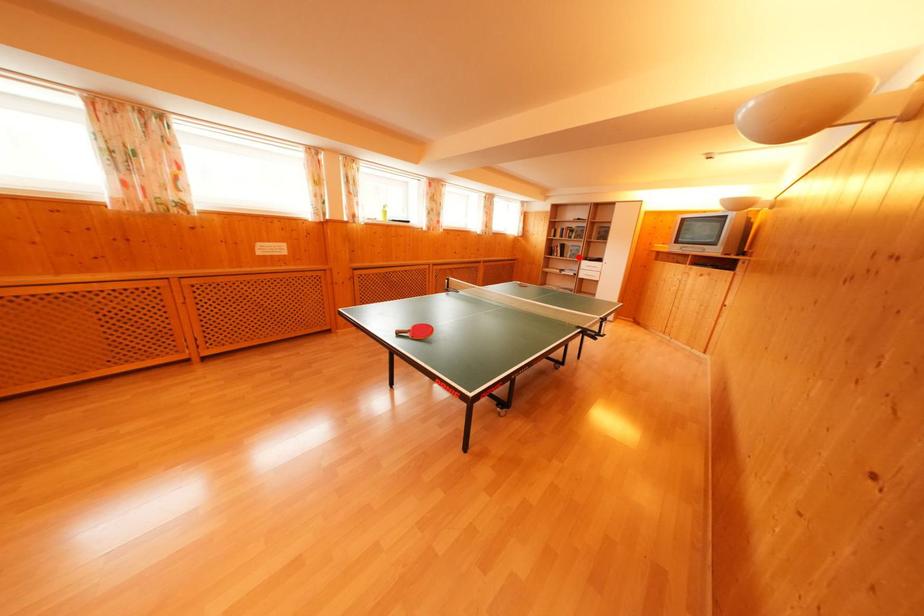
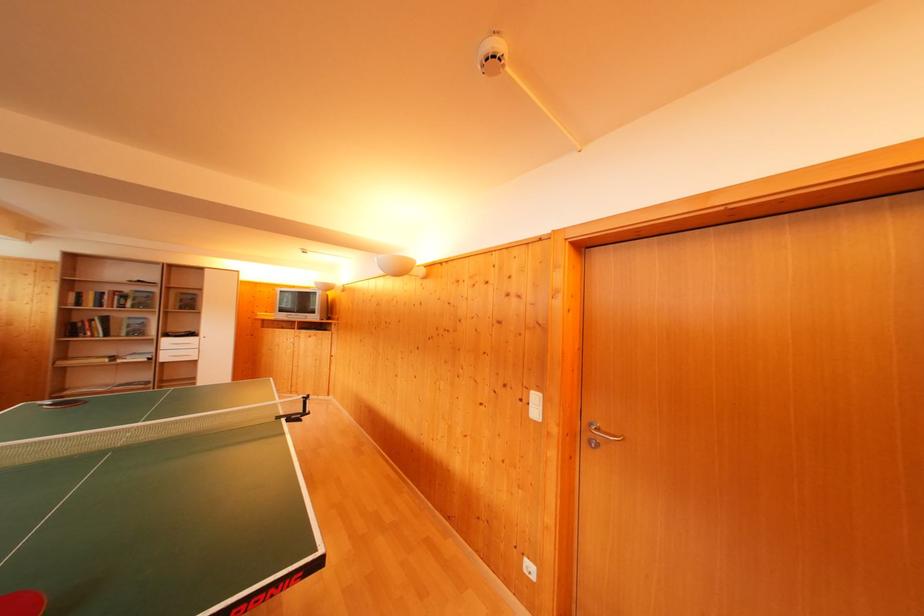
In the second image, find the point that corresponds to the highlighted location in the first image.

(140, 331)